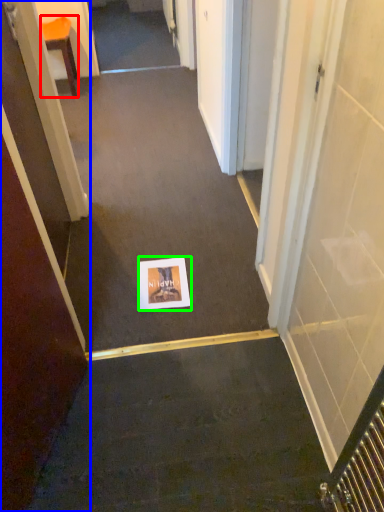
Question: Considering the real-world distances, which object is closest to furniture (highlighted by a red box)? door (highlighted by a blue box) or postcard (highlighted by a green box).

Choices:
 (A) door
 (B) postcard

Answer: (B)